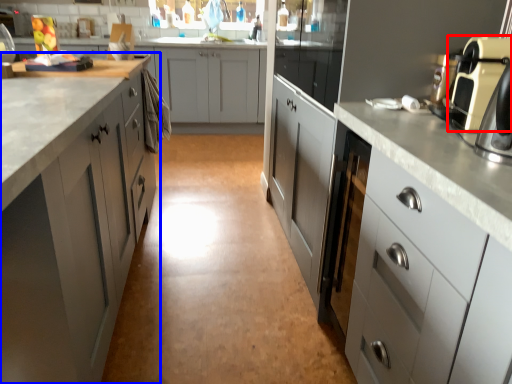
Question: Which point is closer to the camera, home appliance (highlighted by a red box) or cabinetry (highlighted by a blue box)?

Choices:
 (A) home appliance
 (B) cabinetry

Answer: (B)